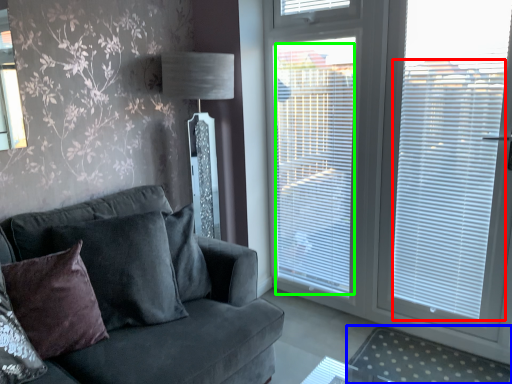
Question: Which object is the closest to the blind (highlighted by a red box)? Choose among these: plain (highlighted by a blue box) or blind (highlighted by a green box).

Choices:
 (A) plain
 (B) blind

Answer: (B)